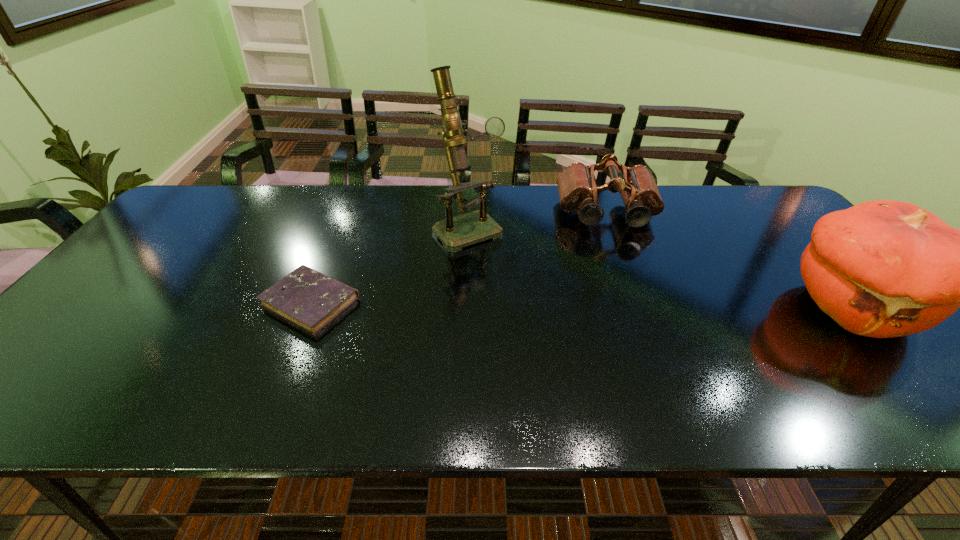
Locate an element on the screen. This screenshot has width=960, height=540. free space on the desktop that is between the leftmost object and the rightmost object and is positioned at the eyepiece of the microscope is located at coordinates pos(537,304).

Find the location of a particular element. This screenshot has height=540, width=960. free space on the desktop that is between the leftmost object and the second tallest object and is positioned through the eyepieces of the third object from left to right is located at coordinates (629, 305).